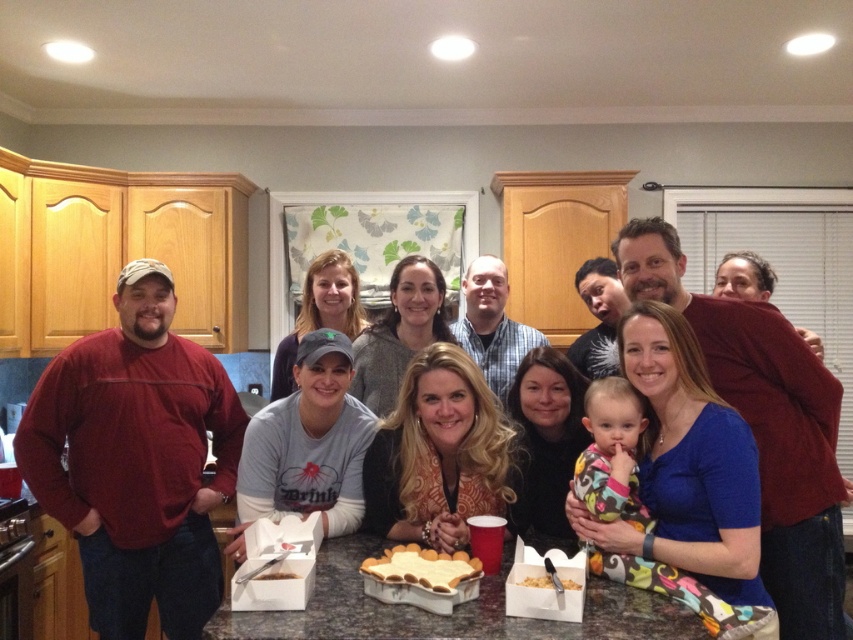
You are standing in the kitchen and want to grab the red cotton shirt at left to hand it to someone. Is it within your immediate reach?

The red cotton shirt at left is 1.99 meters from viewer, which is just under 2 meters away. Depending on your arm length, it might be slightly out of reach but could be attainable with a slight stretch.

You are a photographer trying to capture a closeup of the crumbly brown cake at center without including the red cotton shirt at left in the frame. Based on their positions, is this possible?

The red cotton shirt at left is positioned on the right side of crumbly brown cake at center, meaning the shirt is to the right of the cake. To avoid including the shirt, you can position the camera to the left side of the cake so that the shirt is out of frame.